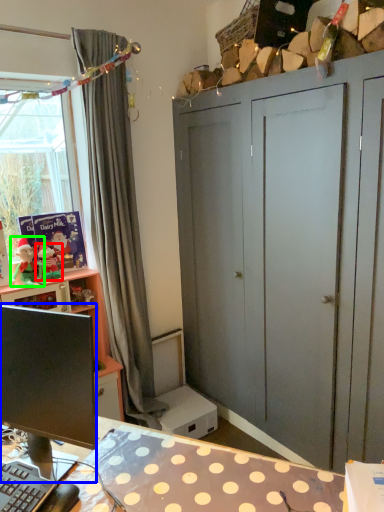
Question: Estimate the real-world distances between objects in this image. Which object is closer to toy (highlighted by a red box), computer monitor (highlighted by a blue box) or person (highlighted by a green box)?

Choices:
 (A) computer monitor
 (B) person

Answer: (B)